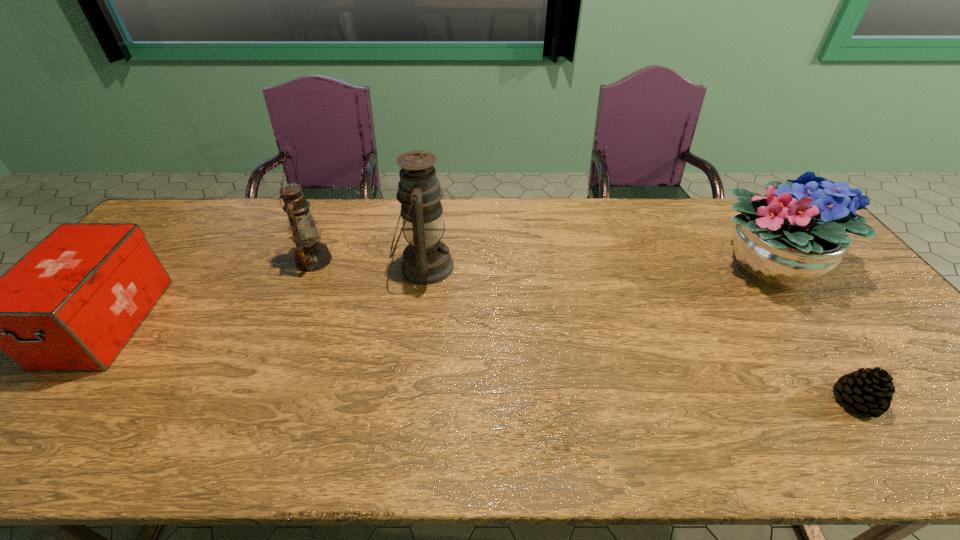
Locate an element on the screen. The height and width of the screenshot is (540, 960). free space located on the handle side of the first-aid kit is located at coordinates (0, 452).

At what (x,y) coordinates should I click in order to perform the action: click on free region located 0.360m at the narrow end of the shortest object. Please return your answer as a coordinate pair (x, y). Looking at the image, I should click on pyautogui.click(x=674, y=401).

This screenshot has width=960, height=540. Find the location of `free space located 0.190m at the narrow end of the shortest object`. free space located 0.190m at the narrow end of the shortest object is located at coordinates tap(750, 401).

Image resolution: width=960 pixels, height=540 pixels. Find the location of `free space located 0.370m at the narrow end of the shortest object`. free space located 0.370m at the narrow end of the shortest object is located at coordinates (670, 401).

This screenshot has width=960, height=540. In order to click on object present at the far edge in this screenshot , I will do `click(798, 232)`.

Where is `object that is positioned at the near edge`? The height and width of the screenshot is (540, 960). object that is positioned at the near edge is located at coordinates (870, 391).

Where is `object at the left edge`? This screenshot has width=960, height=540. object at the left edge is located at coordinates tap(72, 303).

The image size is (960, 540). Identify the location of object located at the right edge. (798, 232).

I want to click on object located in the far right corner section of the desktop, so click(x=798, y=232).

Where is `vacant space at the far edge`? vacant space at the far edge is located at coordinates (455, 230).